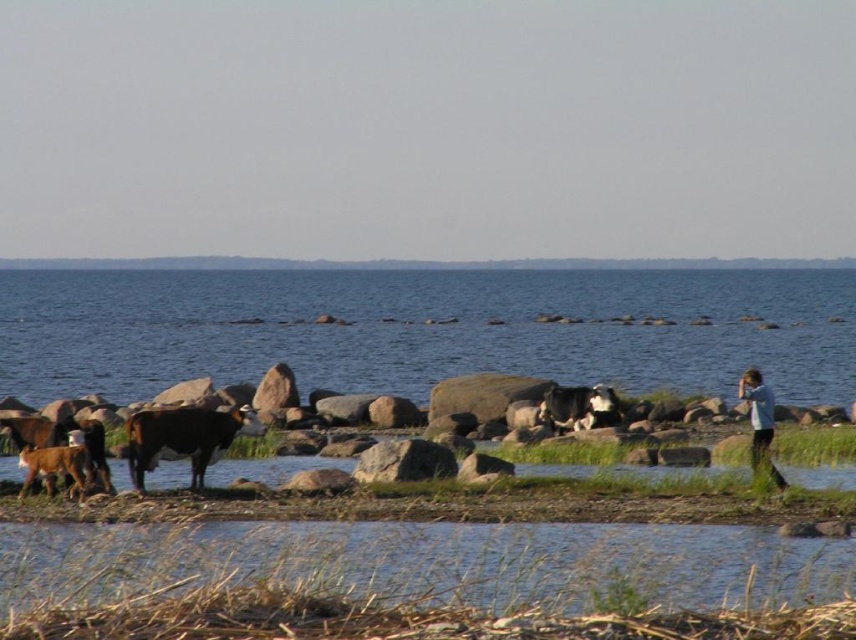
Question: Which of the following is the farthest from the observer?

Choices:
 (A) blue shirt at right
 (B) brown glossy cow at lower left
 (C) blue water at center

Answer: (C)

Question: From the image, what is the correct spatial relationship of blue shirt at right in relation to brown glossy cow at lower left?

Choices:
 (A) left
 (B) right

Answer: (B)

Question: Does brown glossy cow at center have a smaller size compared to brown glossy cow at lower left?

Choices:
 (A) yes
 (B) no

Answer: (B)

Question: Among these objects, which one is nearest to the camera?

Choices:
 (A) black and white cow at center
 (B) brown glossy cow at center

Answer: (B)

Question: Which object appears closest to the camera in this image?

Choices:
 (A) blue shirt at right
 (B) brown glossy cow at lower left
 (C) brown glossy cow at center

Answer: (B)

Question: Can you confirm if blue water at center is thinner than blue shirt at right?

Choices:
 (A) no
 (B) yes

Answer: (A)